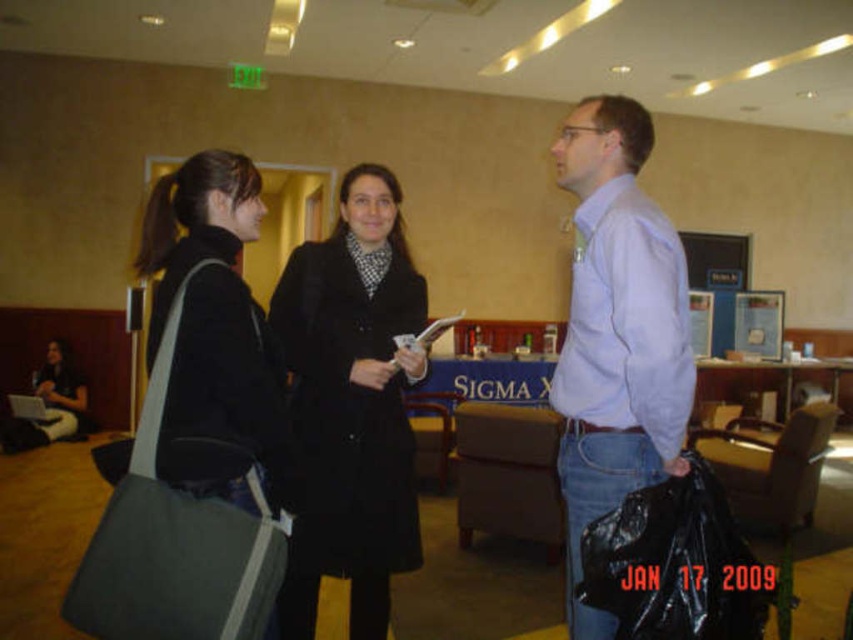
You are a photographer trying to capture a candid shot of the two people at the center of the image. The camera you are using has a minimum focusing distance of 65 centimeters. Can you take a clear photo of both the black wool coat at center and the light blue shirt at center without them being blurry?

The black wool coat at center and the light blue shirt at center are 66.12 centimeters apart. Since the camera requires a minimum focusing distance of 65 centimeters, the distance between them is sufficient for the camera to focus on both subjects clearly.

You are a photographer trying to capture a candid shot of the light blue shirt at center and the dark green canvas bag at left. Your camera has a lens that can focus on objects within a 30 inch range. Can you fit both subjects in the frame without moving the camera?

The light blue shirt at center and dark green canvas bag at left are 34.87 inches apart, which exceeds the 30 inch focus range of your camera lens. Therefore, you cannot fit both subjects in the frame without moving the camera.

Looking at this image, you are organizing a clothing donation drive and need to determine if the black wool coat at center can fit into the dark green canvas bag at left. Based on their sizes, can the coat be placed inside the bag?

The black wool coat at center might be wider than dark green canvas bag at left, so there is a possibility that the coat cannot fit inside the bag due to its width.